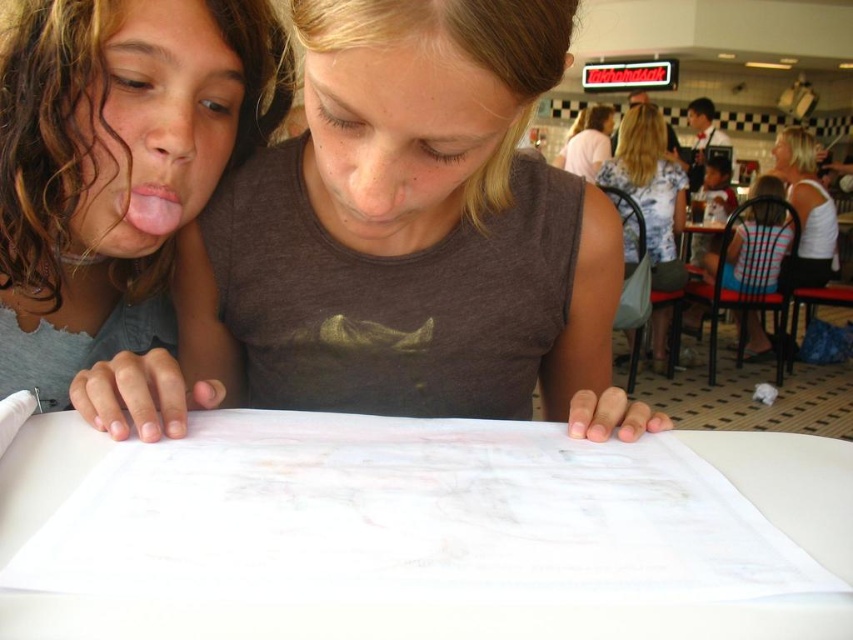
Measure the distance between white fabric shirt at upper right and light pink shirt at upper center.

1.08 meters

Between white fabric shirt at upper right and light pink shirt at upper center, which one has less height?

With less height is light pink shirt at upper center.

The image size is (853, 640). In order to click on white fabric shirt at upper right in this screenshot , I will do `click(805, 204)`.

You are a GUI agent. You are given a task and a screenshot of the screen. Output one action in this format:
    pyautogui.click(x=<x>, y=<y>)
    Task: Click on the white fabric shirt at upper right
    This screenshot has width=853, height=640.
    Given the screenshot: What is the action you would take?
    pyautogui.click(x=805, y=204)

Is matte brown shirt at center thinner than striped fabric shirt at right?

No.

Describe the element at coordinates (412, 232) in the screenshot. The width and height of the screenshot is (853, 640). I see `matte brown shirt at center` at that location.

Is point (404, 353) positioned behind point (735, 252)?

No, (404, 353) is closer to viewer.

This screenshot has width=853, height=640. Find the location of `matte brown shirt at center`. matte brown shirt at center is located at coordinates (412, 232).

Locate an element on the screen. matte gray shirt at center is located at coordinates (125, 196).